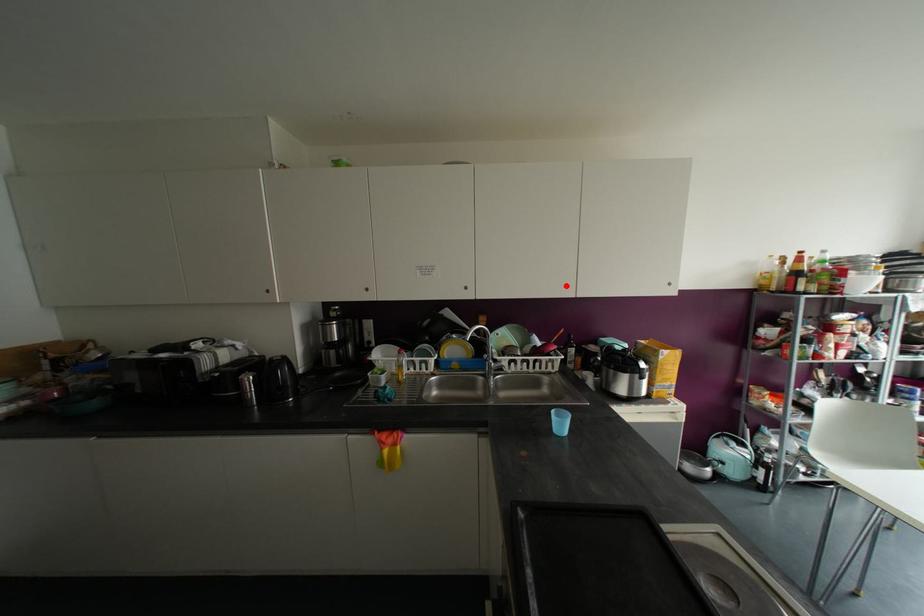
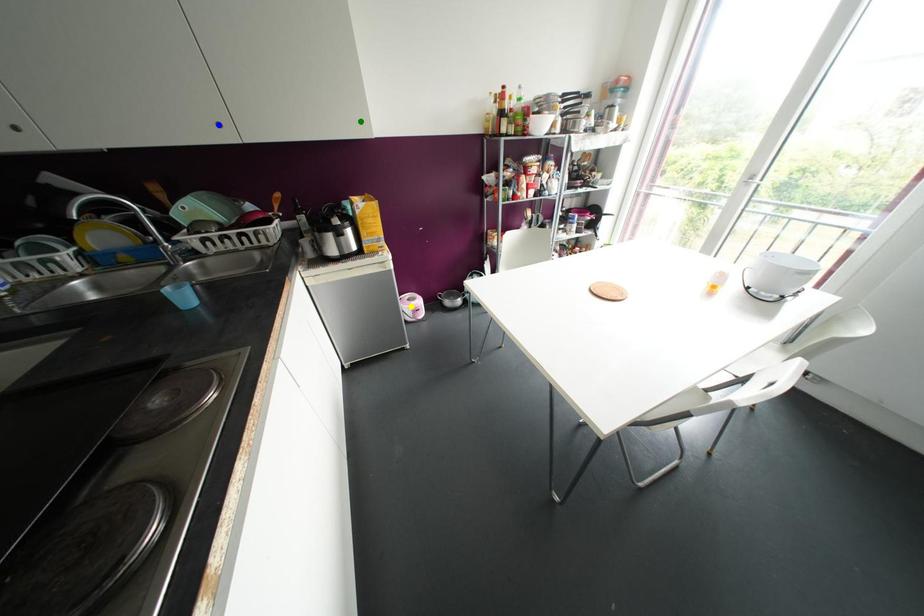
Question: I am providing you with two images of the same scene from different viewpoints. A red point is marked on the first image. You are given multiple points on the second image. Which spot in image 2 lines up with the point in image 1?

Choices:
 (A) blue point
 (B) yellow point
 (C) green point

Answer: (A)